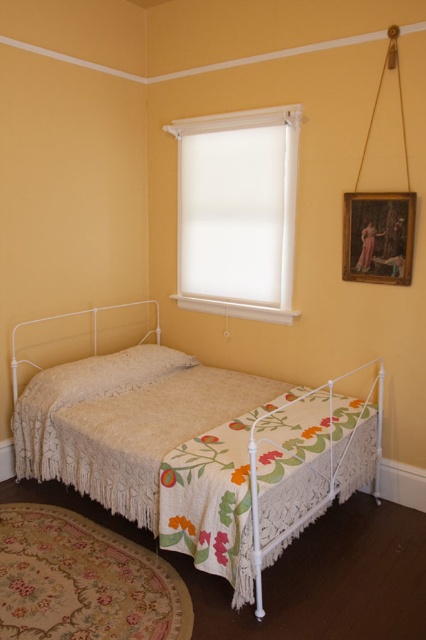
Consider the image. You are trying to decide whether to hang a new painting that is 1.2 meters tall on the wall above your bed. The current wooden framed painting at upper right is 1 meter tall. Based on the scene, can you determine if the new painting will fit vertically above the white lace bed at center without exceeding the available space?

The white lace bed at center is taller than the wooden framed painting at upper right. Since the new painting is 1.2 meters tall, which is taller than the existing wooden framed painting at upper right, it may not fit vertically above the white lace bed at center if the available space is limited by the height of the bed.

Consider the image. You are an interior designer planning to add a new piece of furniture in the bedroom. The white lace bed at center and the wooden framed painting at upper right are already present. Considering their sizes, which one would you need to position more carefully to avoid blocking the window above the bed?

The white lace bed at center is larger in size than the wooden framed painting at upper right, so you would need to position the white lace bed at center more carefully to avoid blocking the window above the bed.

You are an interior designer planning to hang a new picture frame that is 30 cm wide. You see the white matte window at upper center and the wooden framed painting at upper right. Which object can the new frame fit next to without overlapping? Please consider their widths.

The white matte window at upper center might be wider than the wooden framed painting at upper right, so the new frame can fit next to the wooden framed painting at upper right if there is enough space on its side. However, the exact width of the window is uncertain, so it is safer to measure both before deciding.